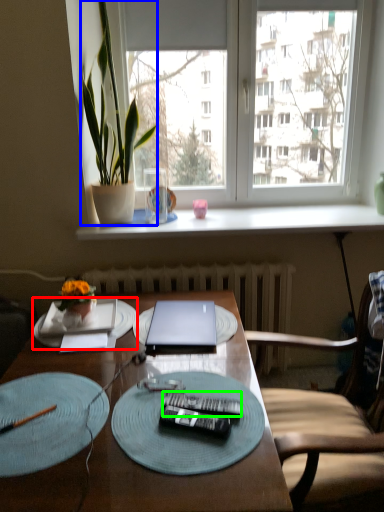
Question: Which object is positioned farthest from platter (highlighted by a red box)? Select from houseplant (highlighted by a blue box) and remote control (highlighted by a green box).

Choices:
 (A) houseplant
 (B) remote control

Answer: (A)